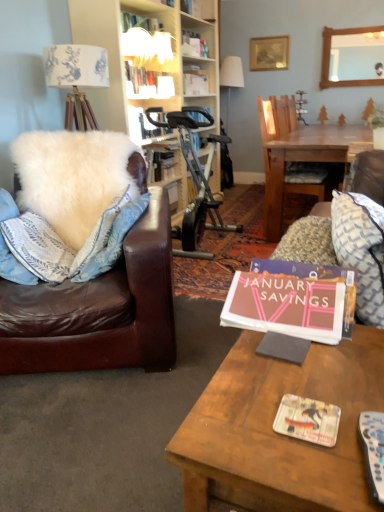
Image resolution: width=384 pixels, height=512 pixels. I want to click on vacant point to the right of matte paper magazine at center, so click(362, 395).